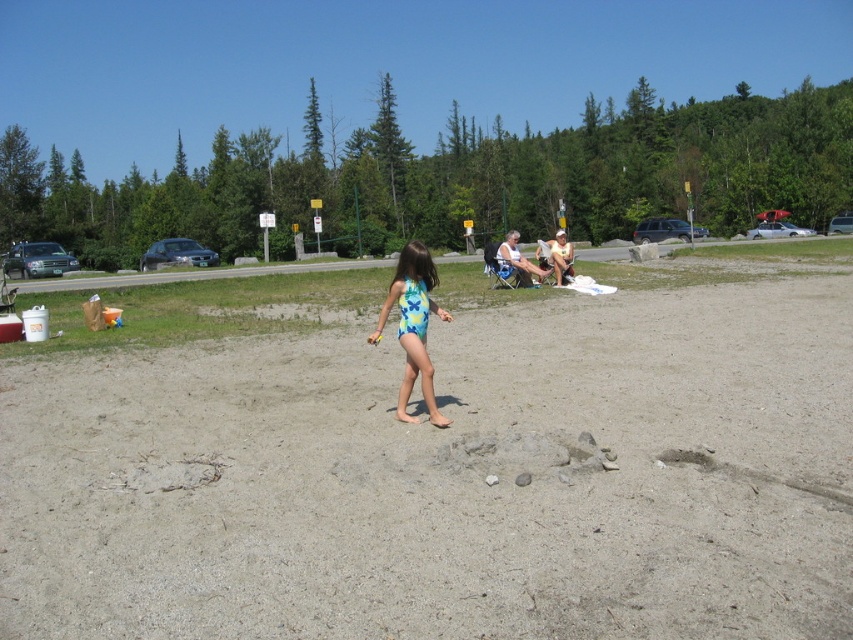
You are a parent trying to set up a beach umbrella for shade. You have a light brown wooden chair at center and need to place it on the gray sand at center. Will the sand be able to support the chair without sinking?

The gray sand at center is much taller than the light brown wooden chair at center, so the sand is deep enough to potentially support the chair without it sinking completely. However, since sand can shift, it might require some firm placement to ensure stability.

You are a photographer trying to capture the gray sand at center and the light brown wooden chair at center in the same frame. Based on their positions, which object should you adjust your camera to focus on first if you want to include both in your shot?

The gray sand at center is to the left of the light brown wooden chair at center, so you should focus on the light brown wooden chair at center first to ensure both objects are captured in the frame.